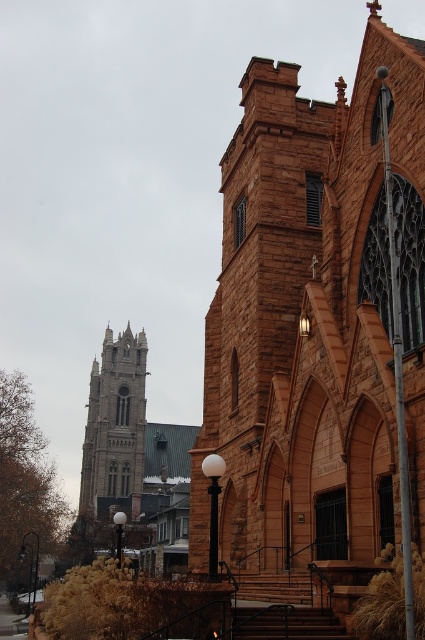
Question: Which point is farther from the camera taking this photo?

Choices:
 (A) (317, 131)
 (B) (101, 404)

Answer: (B)

Question: Can you confirm if brown stone church at center is positioned to the right of stone gothic tower at upper left?

Choices:
 (A) no
 (B) yes

Answer: (B)

Question: Is brown stone church at center to the right of stone gothic tower at upper left from the viewer's perspective?

Choices:
 (A) no
 (B) yes

Answer: (B)

Question: Does brown stone church at center have a lesser width compared to stone gothic tower at upper left?

Choices:
 (A) no
 (B) yes

Answer: (B)